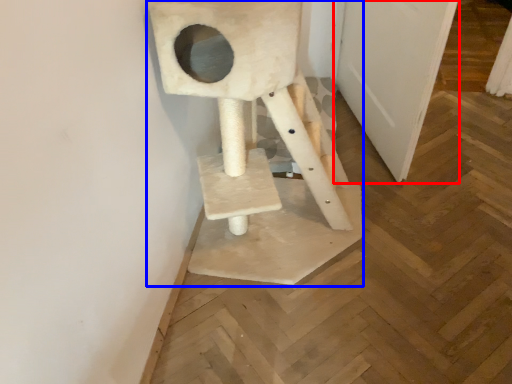
Question: Which of the following is the farthest to the observer, door (highlighted by a red box) or sculpture (highlighted by a blue box)?

Choices:
 (A) door
 (B) sculpture

Answer: (A)